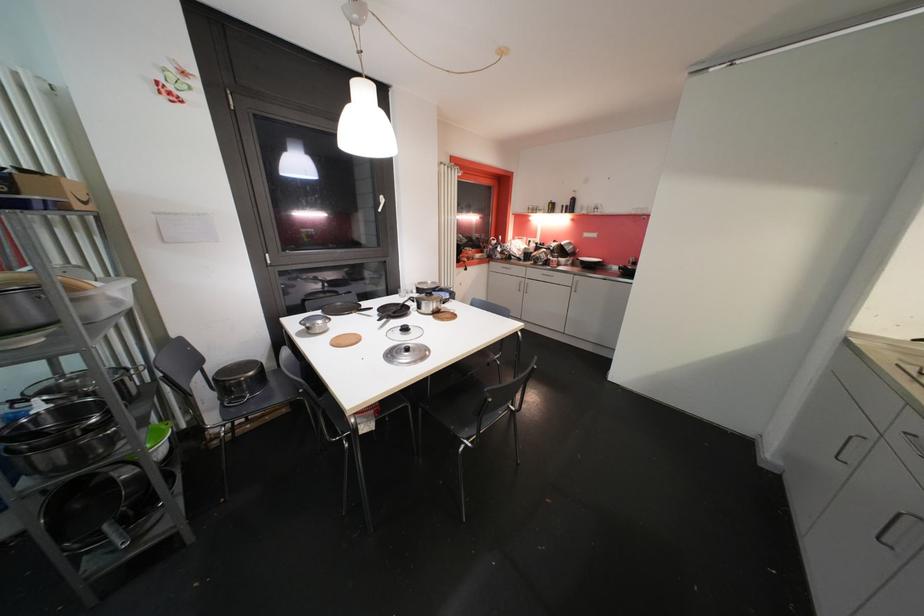
The width and height of the screenshot is (924, 616). What do you see at coordinates (116, 533) in the screenshot?
I see `a pot handle` at bounding box center [116, 533].